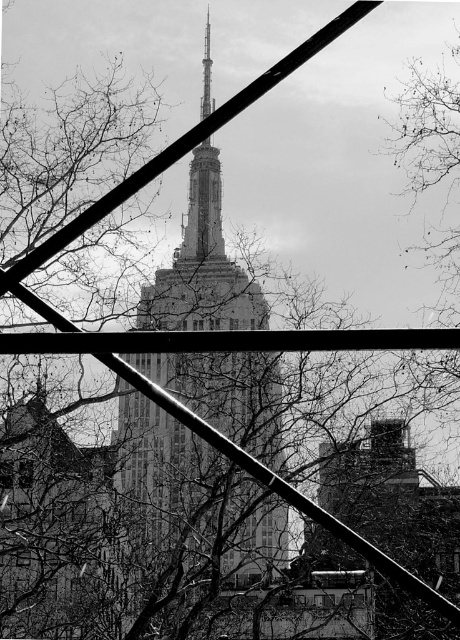
Question: Does smooth stone tower at center have a larger size compared to transparent glass window at lower center?

Choices:
 (A) yes
 (B) no

Answer: (A)

Question: Can you confirm if smooth stone tower at center is positioned above transparent glass window at lower center?

Choices:
 (A) no
 (B) yes

Answer: (B)

Question: Considering the real-world distances, which object is closest to the transparent glass window at lower left?

Choices:
 (A) transparent glass window at lower center
 (B) smooth stone tower at center

Answer: (B)

Question: Which object is farther from the camera taking this photo?

Choices:
 (A) transparent glass window at lower left
 (B) smooth stone tower at center

Answer: (A)

Question: Is smooth stone tower at center to the right of transparent glass window at lower left from the viewer's perspective?

Choices:
 (A) yes
 (B) no

Answer: (A)

Question: Which of these objects is positioned closest to the transparent glass window at lower center?

Choices:
 (A) transparent glass window at lower left
 (B) smooth stone tower at center

Answer: (B)